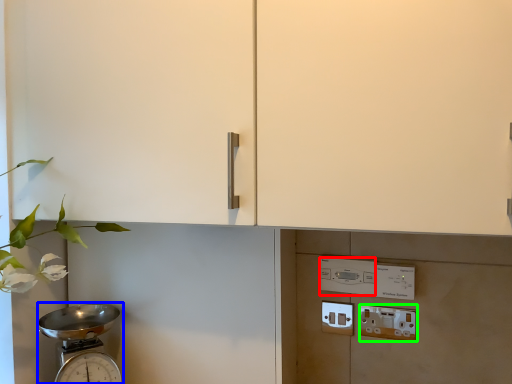
Question: Estimate the real-world distances between objects in this image. Which object is farther from light switch (highlighted by a red box), scale (highlighted by a blue box) or electric outlet (highlighted by a green box)?

Choices:
 (A) scale
 (B) electric outlet

Answer: (A)